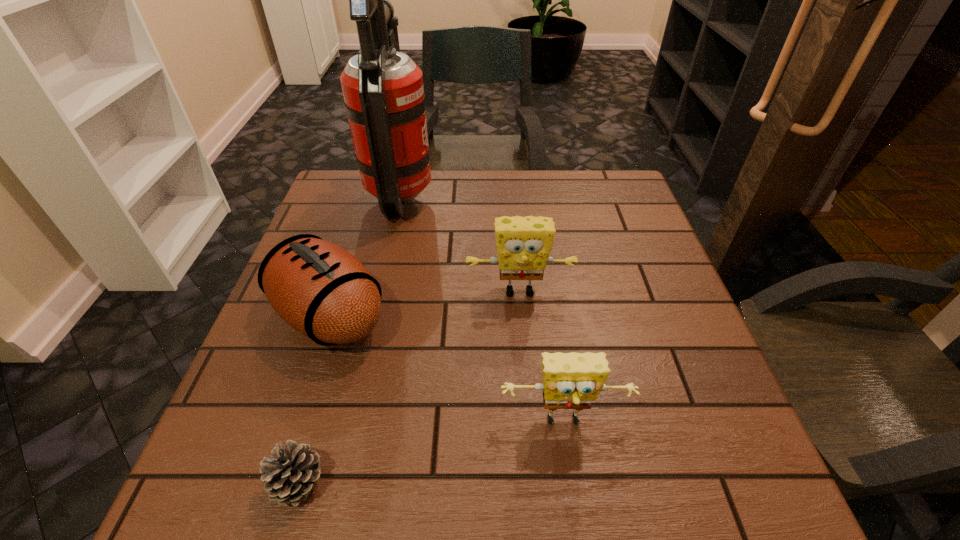
I want to click on vacant space located 0.350m on the back of the football (American), so click(371, 189).

Where is `free space located on the right of the nearest object`? free space located on the right of the nearest object is located at coordinates (553, 482).

I want to click on object that is positioned at the far edge, so click(383, 90).

This screenshot has height=540, width=960. Identify the location of object that is at the near edge. (291, 473).

This screenshot has width=960, height=540. Identify the location of fire extinguisher that is positioned at the left edge. (x=383, y=90).

Find the location of `football (American) located in the left edge section of the desktop`. football (American) located in the left edge section of the desktop is located at coordinates (321, 290).

Identify the location of pinecone present at the left edge. (291, 473).

Identify the location of object present at the far left corner. Image resolution: width=960 pixels, height=540 pixels. (383, 90).

Where is `object situated at the near left corner`? The width and height of the screenshot is (960, 540). object situated at the near left corner is located at coordinates (291, 473).

Image resolution: width=960 pixels, height=540 pixels. In the image, there is a desktop. Find the location of `vacant space at the far edge`. vacant space at the far edge is located at coordinates (564, 214).